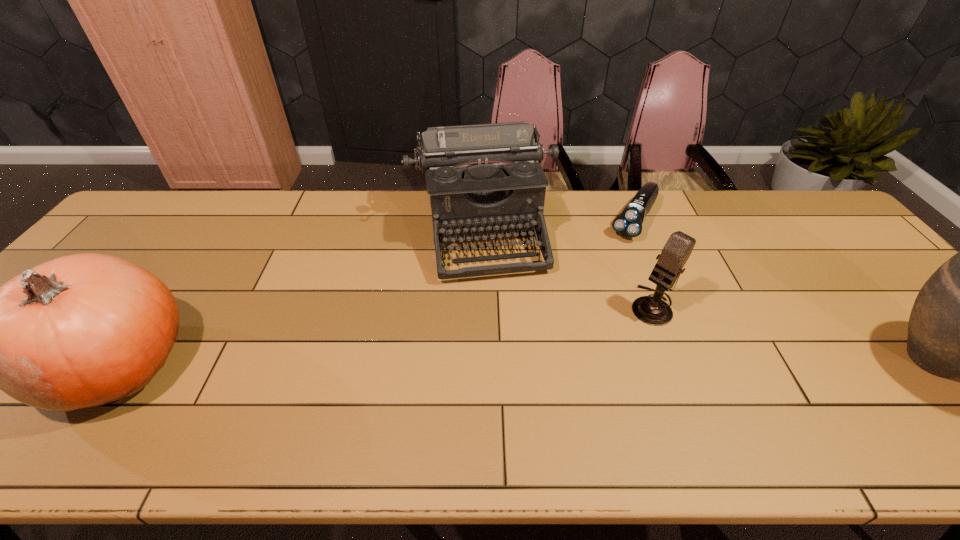
Find the location of `free location located 0.360m on the front-facing side of the microphone`. free location located 0.360m on the front-facing side of the microphone is located at coordinates (542, 404).

This screenshot has width=960, height=540. What are the coordinates of `blank space located 0.350m on the front-facing side of the microphone` in the screenshot? It's located at (545, 402).

This screenshot has width=960, height=540. What are the coordinates of `electric shaver positioned at the far edge` in the screenshot? It's located at (629, 223).

Identify the location of typewriter present at the far edge. The height and width of the screenshot is (540, 960). (482, 179).

The width and height of the screenshot is (960, 540). In the image, there is a desktop. In order to click on vacant space at the far edge in this screenshot , I will do `click(559, 228)`.

At what (x,y) coordinates should I click in order to perform the action: click on vacant space at the near edge. Please return your answer as a coordinate pair (x, y). This screenshot has height=540, width=960. Looking at the image, I should click on (864, 380).

The height and width of the screenshot is (540, 960). I want to click on free space at the right edge, so click(878, 283).

Identify the location of free region at the far left corner of the desktop. (160, 195).

Identify the location of free space between the microphone and the electric shaver. (642, 263).

This screenshot has width=960, height=540. I want to click on vacant point located between the typewriter and the electric shaver, so click(558, 226).